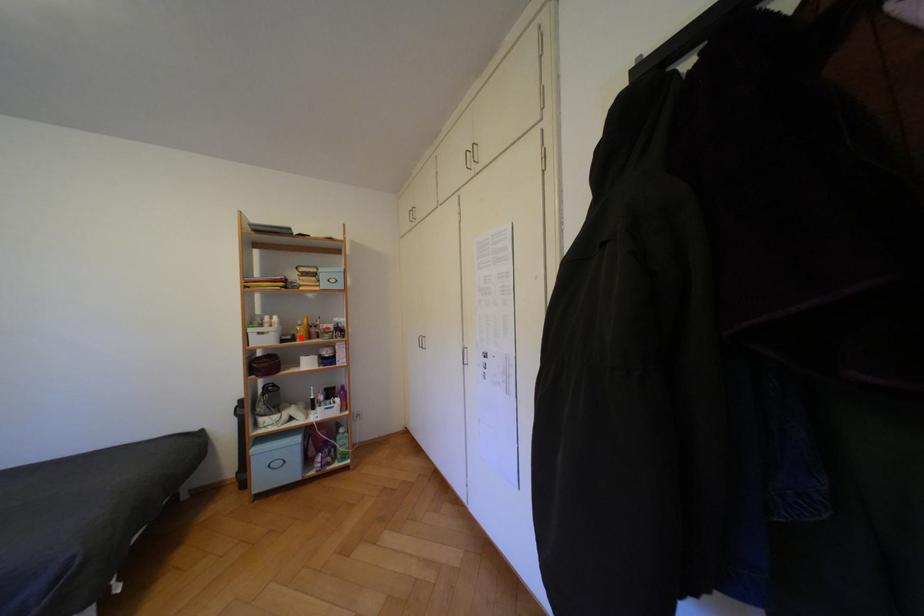
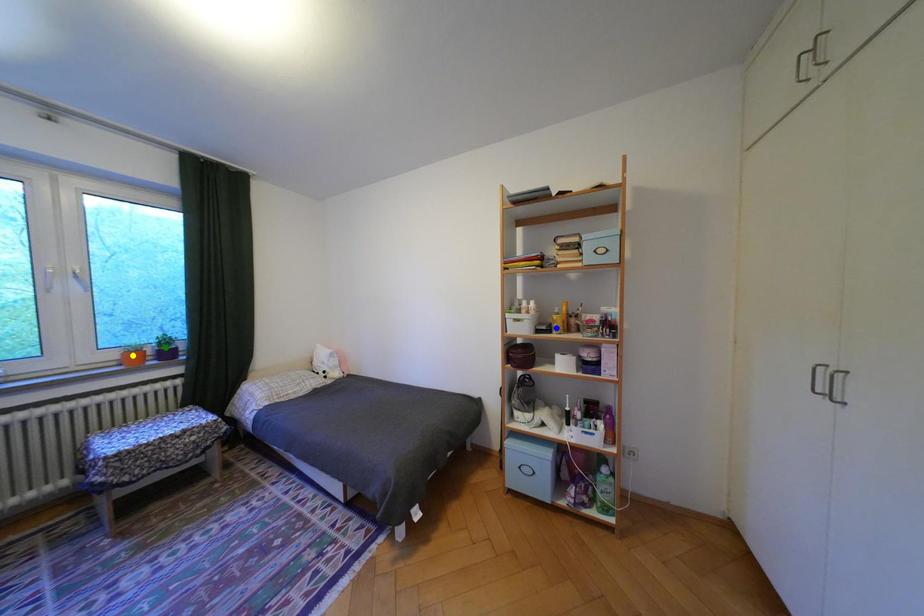
Question: I am providing you with two images of the same scene from different viewpoints. A red point is marked on the first image. You are given multiple points on the second image. Which mark in image 2 goes with the point in image 1?

Choices:
 (A) yellow point
 (B) green point
 (C) blue point

Answer: (C)